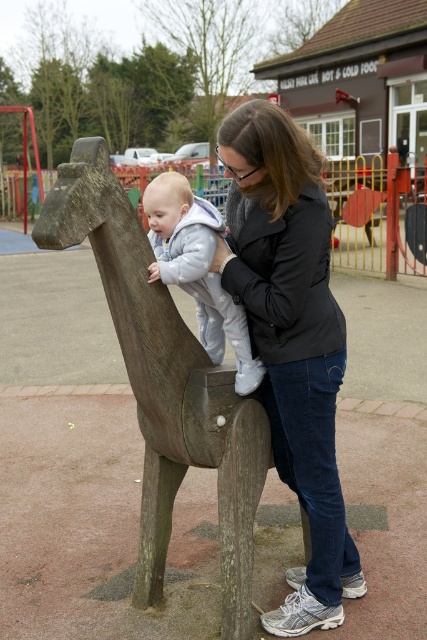
Question: Is matte black jacket at center smaller than light gray fleece onesie at center?

Choices:
 (A) yes
 (B) no

Answer: (B)

Question: Among these points, which one is nearest to the camera?

Choices:
 (A) (163, 179)
 (B) (274, 141)

Answer: (B)

Question: Is matte black jacket at center below light gray fleece onesie at center?

Choices:
 (A) no
 (B) yes

Answer: (B)

Question: Observing the image, what is the correct spatial positioning of matte black jacket at center in reference to light gray fleece onesie at center?

Choices:
 (A) below
 (B) above

Answer: (A)

Question: Which point is farther to the camera?

Choices:
 (A) matte black jacket at center
 (B) light gray fleece onesie at center

Answer: (B)